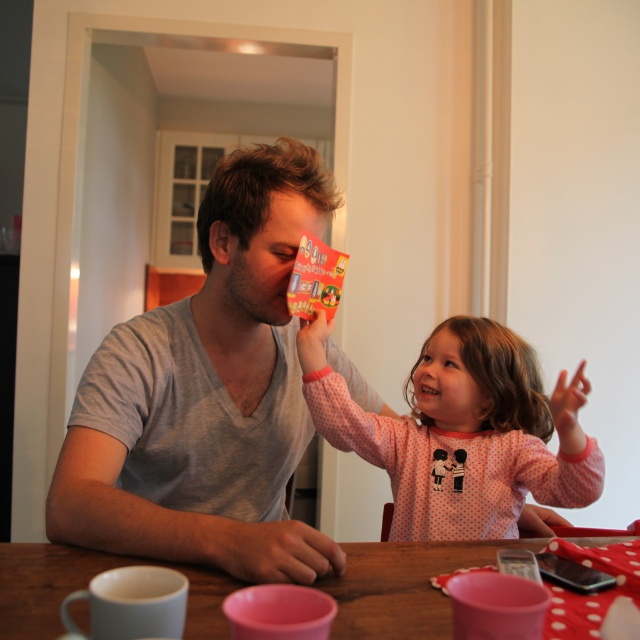
Does gray cotton shirt at center appear over pink dotted pajamas at center?

Indeed, gray cotton shirt at center is positioned over pink dotted pajamas at center.

Which is above, gray cotton shirt at center or pink dotted pajamas at center?

gray cotton shirt at center

Locate an element on the screen. Image resolution: width=640 pixels, height=640 pixels. gray cotton shirt at center is located at coordinates (205, 396).

Looking at this image, can you confirm if gray cotton shirt at center is positioned to the left of wooden table at center?

Indeed, gray cotton shirt at center is positioned on the left side of wooden table at center.

Measure the distance between gray cotton shirt at center and camera.

gray cotton shirt at center and camera are 28.77 inches apart from each other.

The image size is (640, 640). What are the coordinates of `gray cotton shirt at center` in the screenshot? It's located at (205, 396).

I want to click on gray cotton shirt at center, so click(205, 396).

Between pink dotted pajamas at center and wooden table at center, which one appears on the right side from the viewer's perspective?

From the viewer's perspective, pink dotted pajamas at center appears more on the right side.

Who is lower down, pink dotted pajamas at center or wooden table at center?

wooden table at center is below.

Does point (480, 516) come farther from viewer compared to point (372, 579)?

Yes, point (480, 516) is farther from viewer.

The image size is (640, 640). In order to click on pink dotted pajamas at center in this screenshot , I will do `click(452, 440)`.